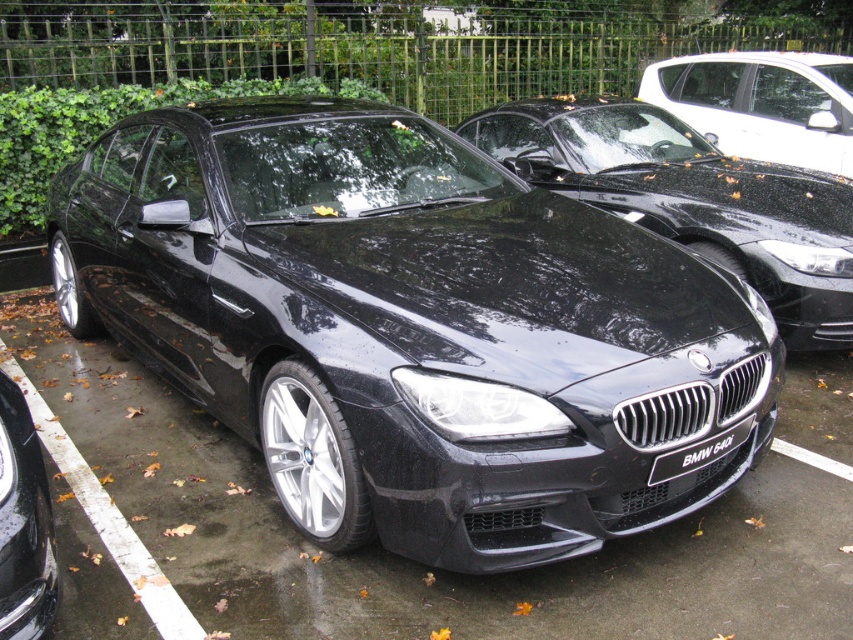
Based on the photo, you are a parking attendant who needs to move the glossy black car at lower left. Can you drive it forward without hitting the glossy black car at upper right?

The glossy black car at lower left is behind the glossy black car at upper right, so you can drive it forward without hitting the other car.

You are standing at the back of the black BMW 640i and want to walk towards the point marked as point (200,198). Will you pass by point (720,83) before reaching your destination?

Since point (200,198) is in front of point (720,83), you will reach point (200,198) before passing point (720,83). Therefore, you will not pass by point (720,83) before reaching your destination.